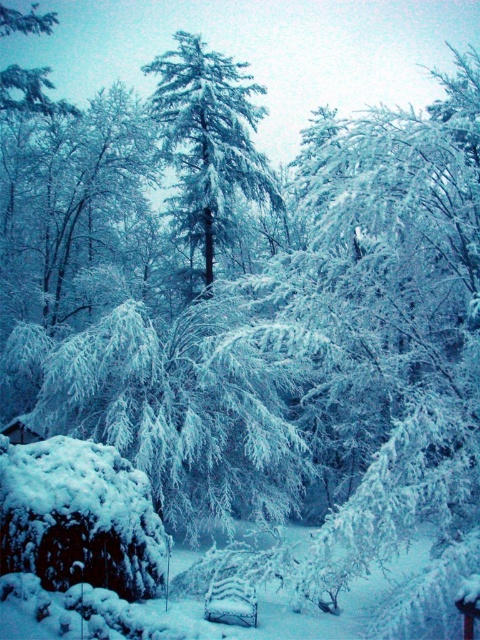
You are standing at the origin point of the scene. Which object is located at the coordinate point (208, 138)?

The point (208, 138) corresponds to the snow covered pine tree at center.